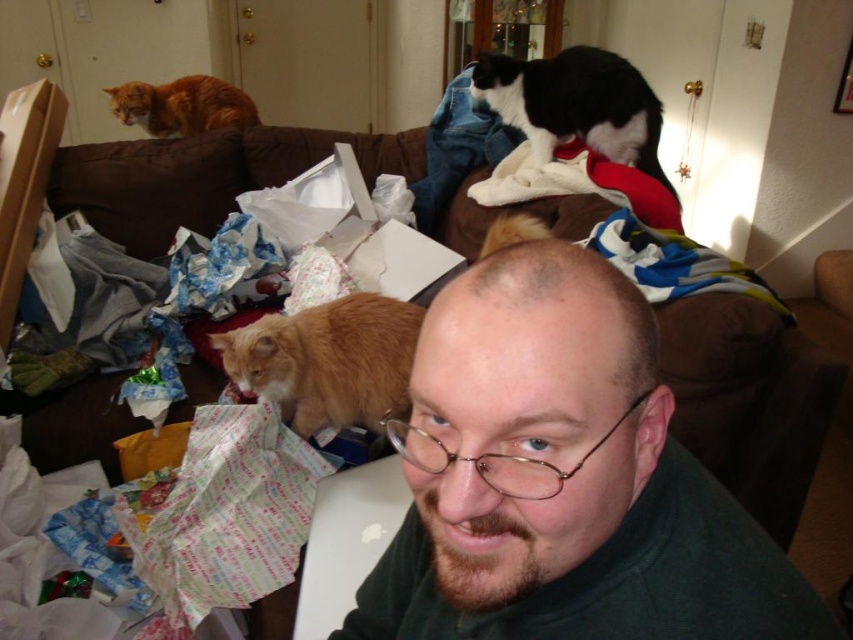
Which of these two, green matte shirt at center or orange fur cat at lower left, stands taller?

Standing taller between the two is green matte shirt at center.

Is green matte shirt at center in front of orange fur cat at lower left?

That is True.

Who is more distant from viewer, (727, 564) or (399, 330)?

Positioned behind is point (399, 330).

This screenshot has width=853, height=640. What are the coordinates of `green matte shirt at center` in the screenshot? It's located at (561, 477).

Does green matte shirt at center lie in front of brown fabric couch at center?

Yes.

Does green matte shirt at center appear on the right side of brown fabric couch at center?

Correct, you'll find green matte shirt at center to the right of brown fabric couch at center.

Does point (442, 586) come in front of point (728, 433)?

Yes, point (442, 586) is closer to viewer.

I want to click on green matte shirt at center, so click(x=561, y=477).

Who is lower down, brown fabric couch at center or orange fur cat at upper left?

brown fabric couch at center

Who is higher up, brown fabric couch at center or orange fur cat at upper left?

orange fur cat at upper left is above.

Does point (144, 237) come farther from viewer compared to point (206, 125)?

That is False.

Find the location of a particular element. This screenshot has width=853, height=640. brown fabric couch at center is located at coordinates (749, 401).